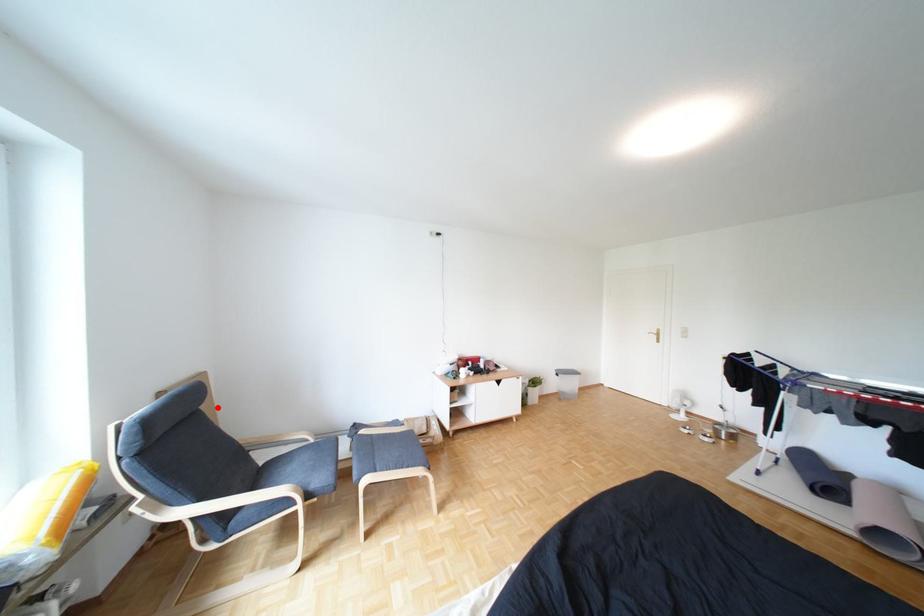
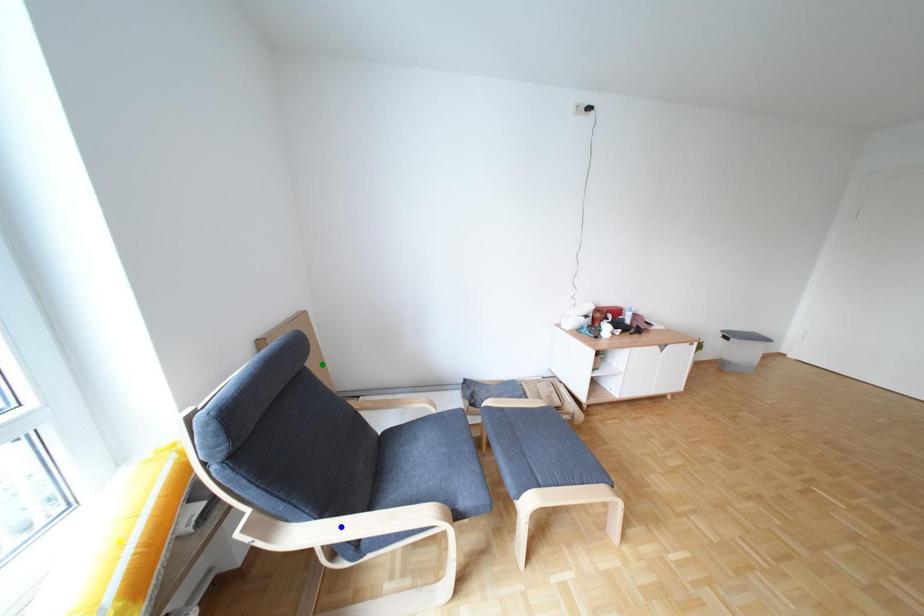
Question: I am providing you with two images of the same scene from different viewpoints. A red point is marked on the first image. You are given multiple points on the second image. Which mark in image 2 goes with the point in image 1?

Choices:
 (A) yellow point
 (B) blue point
 (C) green point

Answer: (C)